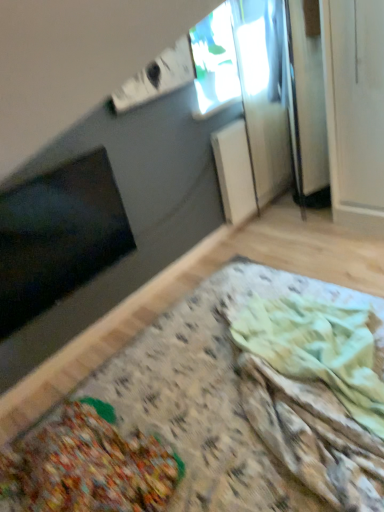
Question: Is black matte window screen at lower left bigger than wooden table at lower left?

Choices:
 (A) yes
 (B) no

Answer: (B)

Question: Is black matte window screen at lower left located outside wooden table at lower left?

Choices:
 (A) yes
 (B) no

Answer: (A)

Question: From a real-world perspective, is black matte window screen at lower left below wooden table at lower left?

Choices:
 (A) no
 (B) yes

Answer: (A)

Question: Can you confirm if black matte window screen at lower left is taller than wooden table at lower left?

Choices:
 (A) no
 (B) yes

Answer: (A)

Question: From the image's perspective, would you say black matte window screen at lower left is shown under wooden table at lower left?

Choices:
 (A) no
 (B) yes

Answer: (A)

Question: Is black matte window screen at lower left directly adjacent to wooden table at lower left?

Choices:
 (A) no
 (B) yes

Answer: (A)

Question: Does textured fabric blanket at lower center contain black matte window screen at lower left?

Choices:
 (A) no
 (B) yes

Answer: (A)

Question: Is textured fabric blanket at lower center bigger than black matte window screen at lower left?

Choices:
 (A) yes
 (B) no

Answer: (B)

Question: Could you tell me if textured fabric blanket at lower center is facing black matte window screen at lower left?

Choices:
 (A) no
 (B) yes

Answer: (A)

Question: Considering the relative sizes of textured fabric blanket at lower center and black matte window screen at lower left in the image provided, is textured fabric blanket at lower center shorter than black matte window screen at lower left?

Choices:
 (A) yes
 (B) no

Answer: (A)

Question: Is textured fabric blanket at lower center positioned behind black matte window screen at lower left?

Choices:
 (A) no
 (B) yes

Answer: (A)

Question: Can you confirm if textured fabric blanket at lower center is taller than black matte window screen at lower left?

Choices:
 (A) yes
 (B) no

Answer: (B)

Question: Is wooden table at lower left facing away from transparent glass window at upper center?

Choices:
 (A) yes
 (B) no

Answer: (B)